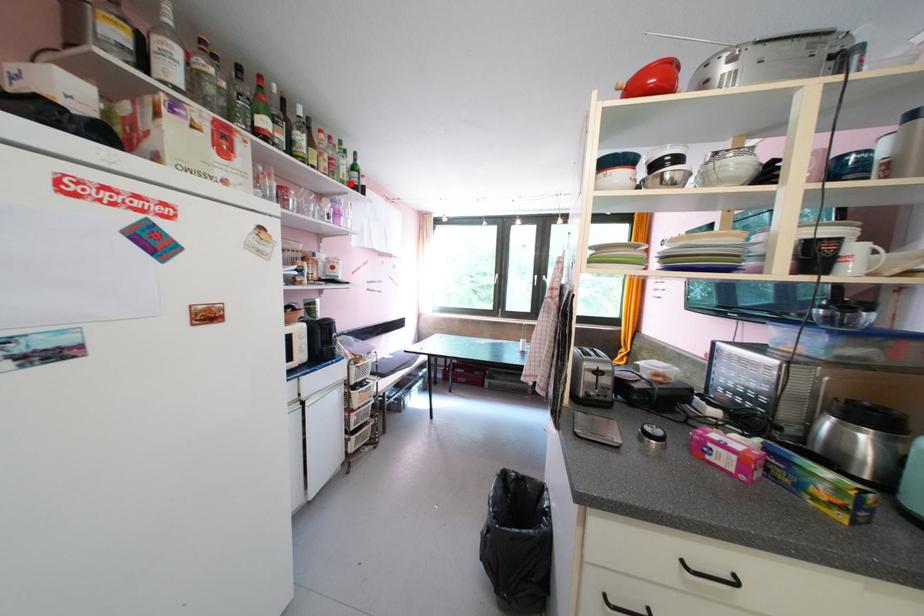
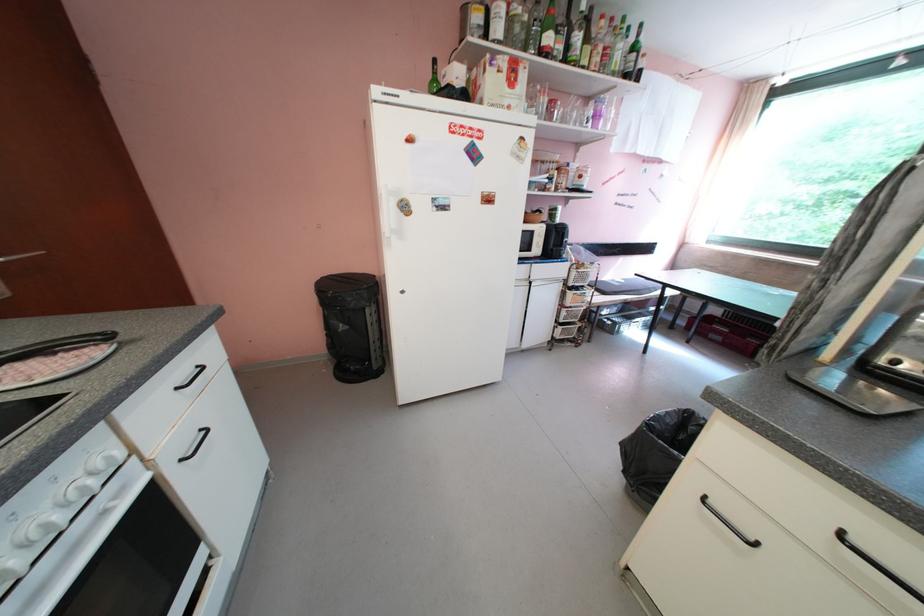
Find the pixel in the second image that matches the highlighted location in the first image.

(622, 75)